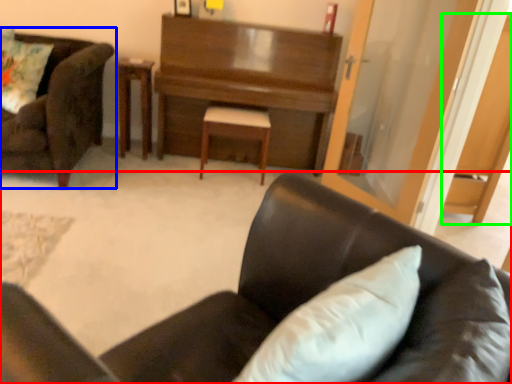
Question: Which object is positioned farthest from chair (highlighted by a red box)? Select from chair (highlighted by a blue box) and dark (highlighted by a green box).

Choices:
 (A) chair
 (B) dark

Answer: (B)